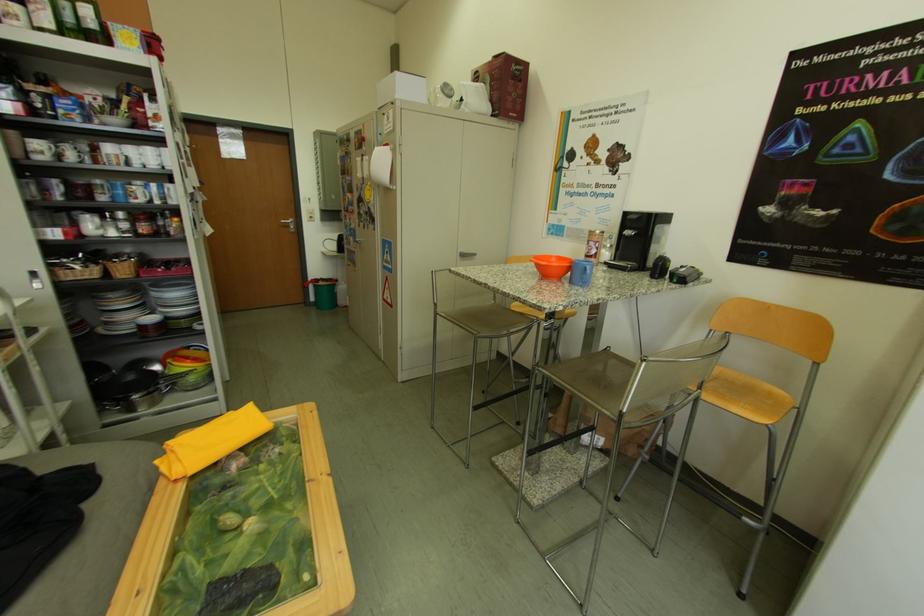
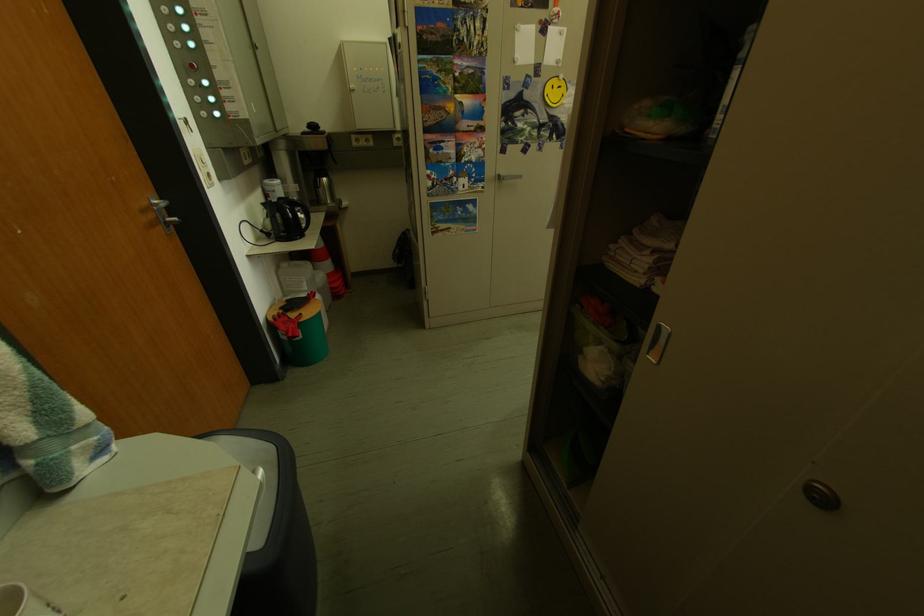
Find the pixel in the second image that matches (x=375, y=188) in the first image.

(546, 82)